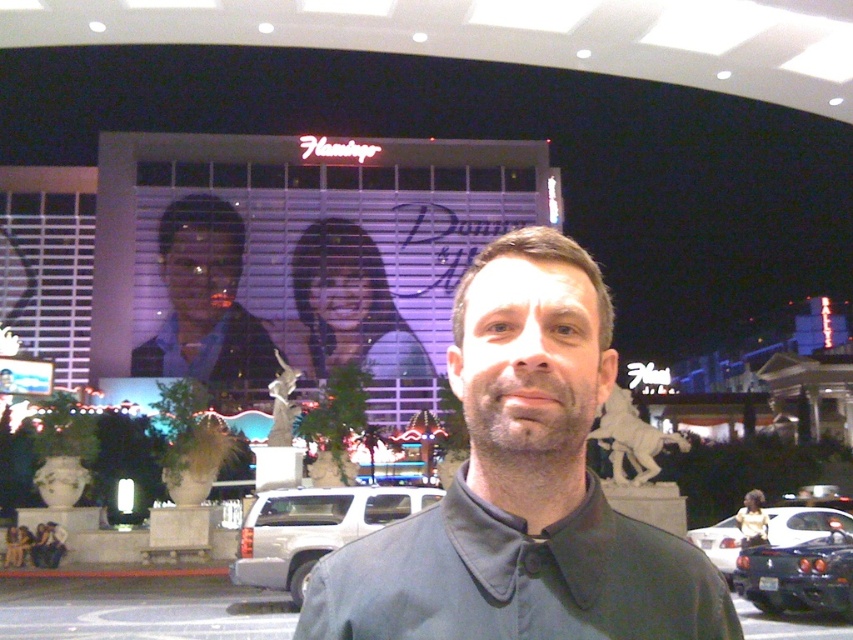
Question: Which point is closer to the camera?

Choices:
 (A) (550, 442)
 (B) (206, 316)
 (C) (498, 608)

Answer: (C)

Question: In this image, where is black matte shirt at center located relative to matte black man at center?

Choices:
 (A) above
 (B) below

Answer: (B)

Question: Which point is closer to the camera?

Choices:
 (A) matte black man at center
 (B) black matte shirt at center

Answer: (B)

Question: Which of the following is the closest to the observer?

Choices:
 (A) black matte shirt at center
 (B) matte black man at center
 (C) dark gray cotton dress shirt at center

Answer: (C)

Question: Can you confirm if black matte shirt at center is positioned below matte black man at center?

Choices:
 (A) no
 (B) yes

Answer: (B)

Question: Is black matte shirt at center behind dark gray cotton dress shirt at center?

Choices:
 (A) yes
 (B) no

Answer: (A)